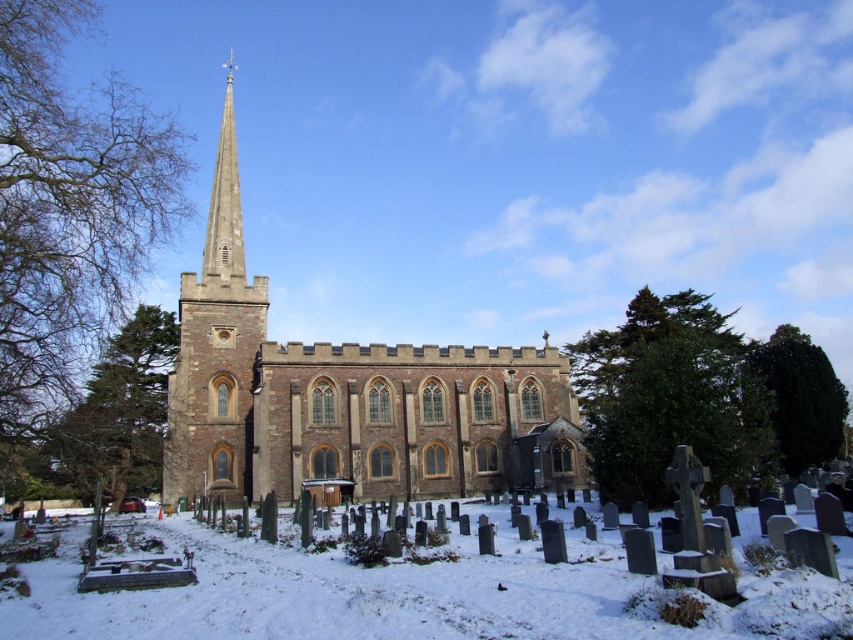
Question: Does brown stone church at center have a lesser width compared to white powdery snow at lower center?

Choices:
 (A) no
 (B) yes

Answer: (B)

Question: Is brown stone church at center wider than white powdery snow at lower center?

Choices:
 (A) no
 (B) yes

Answer: (A)

Question: Is brown stone church at center bigger than white powdery snow at lower center?

Choices:
 (A) yes
 (B) no

Answer: (A)

Question: Which of the following is the closest to the observer?

Choices:
 (A) white powdery snow at lower center
 (B) brown stone church at center

Answer: (A)

Question: Which point is farther from the camera taking this photo?

Choices:
 (A) (263, 483)
 (B) (173, 612)

Answer: (A)